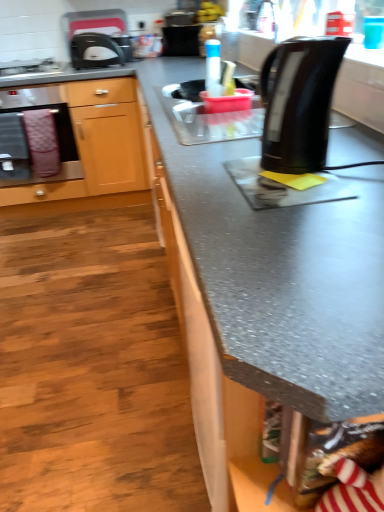
Question: From the image's perspective, is wooden cabinet at left over matte black toaster at upper left?

Choices:
 (A) no
 (B) yes

Answer: (A)

Question: Is wooden cabinet at left outside of matte black toaster at upper left?

Choices:
 (A) no
 (B) yes

Answer: (B)

Question: Can you confirm if wooden cabinet at left is taller than matte black toaster at upper left?

Choices:
 (A) yes
 (B) no

Answer: (A)

Question: Is wooden cabinet at left smaller than matte black toaster at upper left?

Choices:
 (A) yes
 (B) no

Answer: (B)

Question: Is wooden cabinet at left at the left side of matte black toaster at upper left?

Choices:
 (A) yes
 (B) no

Answer: (A)

Question: Do you think matte black toaster at upper left is within wooden cabinet at left, or outside of it?

Choices:
 (A) inside
 (B) outside

Answer: (B)

Question: From the image's perspective, is matte black toaster at upper left located above or below wooden cabinet at left?

Choices:
 (A) above
 (B) below

Answer: (A)

Question: In terms of height, does matte black toaster at upper left look taller or shorter compared to wooden cabinet at left?

Choices:
 (A) tall
 (B) short

Answer: (B)

Question: In terms of width, does matte black toaster at upper left look wider or thinner when compared to wooden cabinet at left?

Choices:
 (A) thin
 (B) wide

Answer: (A)

Question: In terms of height, does black plastic toaster at upper left look taller or shorter compared to pink fabric towel at left?

Choices:
 (A) short
 (B) tall

Answer: (A)

Question: Looking at the image, does black plastic toaster at upper left seem bigger or smaller compared to pink fabric towel at left?

Choices:
 (A) small
 (B) big

Answer: (B)

Question: From the image's perspective, is black plastic toaster at upper left located above or below pink fabric towel at left?

Choices:
 (A) above
 (B) below

Answer: (A)

Question: Is black plastic toaster at upper left in front of or behind pink fabric towel at left in the image?

Choices:
 (A) front
 (B) behind

Answer: (A)

Question: Is stainless steel oven at left bigger or smaller than transparent plastic bottle at center?

Choices:
 (A) big
 (B) small

Answer: (A)

Question: Is point (64, 167) positioned closer to the camera than point (210, 59)?

Choices:
 (A) closer
 (B) farther

Answer: (B)